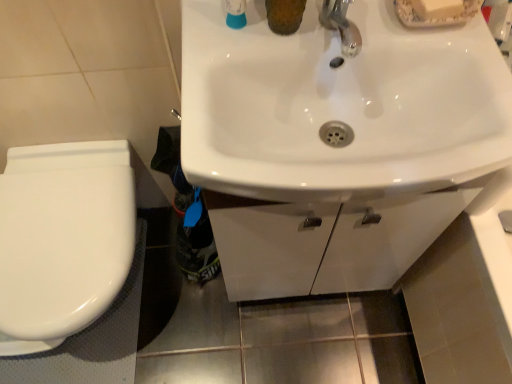
Question: From a real-world perspective, is white glossy sink at center located higher than white glossy toilet at left?

Choices:
 (A) yes
 (B) no

Answer: (A)

Question: Is white glossy sink at center surrounding white glossy toilet at left?

Choices:
 (A) no
 (B) yes

Answer: (A)

Question: Is white glossy sink at center wider than white glossy toilet at left?

Choices:
 (A) yes
 (B) no

Answer: (B)

Question: Is white glossy sink at center closer to camera compared to white glossy toilet at left?

Choices:
 (A) no
 (B) yes

Answer: (B)

Question: Can you confirm if white glossy sink at center is positioned to the right of white glossy toilet at left?

Choices:
 (A) yes
 (B) no

Answer: (A)

Question: From the image's perspective, does white glossy sink at center appear lower than white glossy toilet at left?

Choices:
 (A) yes
 (B) no

Answer: (B)

Question: Considering the relative positions of white glossy toilet at left and white glossy sink at center in the image provided, is white glossy toilet at left to the right of white glossy sink at center from the viewer's perspective?

Choices:
 (A) yes
 (B) no

Answer: (B)

Question: Is white glossy toilet at left placed right next to white glossy sink at center?

Choices:
 (A) yes
 (B) no

Answer: (B)

Question: From the image's perspective, is white glossy toilet at left beneath white glossy sink at center?

Choices:
 (A) yes
 (B) no

Answer: (A)

Question: Is the depth of white glossy toilet at left less than that of white glossy sink at center?

Choices:
 (A) no
 (B) yes

Answer: (A)

Question: From a real-world perspective, does white glossy toilet at left sit lower than white glossy sink at center?

Choices:
 (A) yes
 (B) no

Answer: (A)

Question: Would you say white glossy sink at center is part of white glossy toilet at left's contents?

Choices:
 (A) no
 (B) yes

Answer: (A)

Question: Relative to white glossy sink at center, is white glossy toilet at left in front or behind?

Choices:
 (A) behind
 (B) front

Answer: (A)